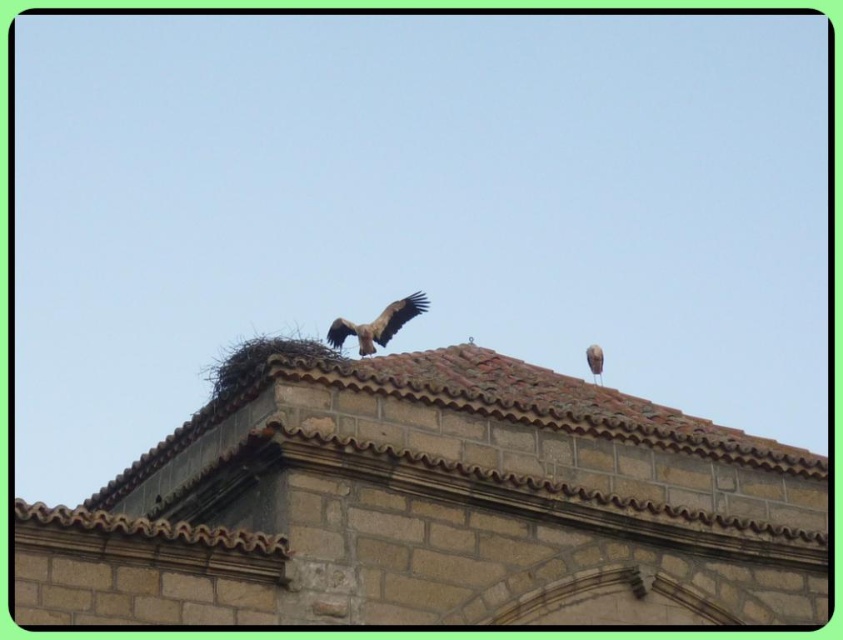
Which of these two, brown tile roof at upper center or brown feathered eagle at center, stands taller?

With more height is brown tile roof at upper center.

Which is more to the left, brown tile roof at upper center or brown feathered eagle at center?

brown tile roof at upper center

Identify the location of brown tile roof at upper center. The width and height of the screenshot is (843, 640). (436, 508).

Can you confirm if brown feathered eagle at center is bigger than brown feathered bird at upper right?

Actually, brown feathered eagle at center might be smaller than brown feathered bird at upper right.

Is brown feathered eagle at center positioned in front of brown feathered bird at upper right?

Yes, brown feathered eagle at center is closer to the viewer.

Between point (329, 328) and point (589, 358), which one is positioned in front?

Point (589, 358) is in front.

The width and height of the screenshot is (843, 640). Find the location of `brown feathered eagle at center`. brown feathered eagle at center is located at coordinates (377, 324).

Who is higher up, brown tile roof at upper center or brown feathered bird at upper right?

brown feathered bird at upper right is higher up.

Does brown tile roof at upper center appear on the right side of brown feathered bird at upper right?

Incorrect, brown tile roof at upper center is not on the right side of brown feathered bird at upper right.

Measure the distance between brown tile roof at upper center and camera.

They are 133.90 feet apart.

This screenshot has height=640, width=843. What are the coordinates of `brown tile roof at upper center` in the screenshot? It's located at (436, 508).